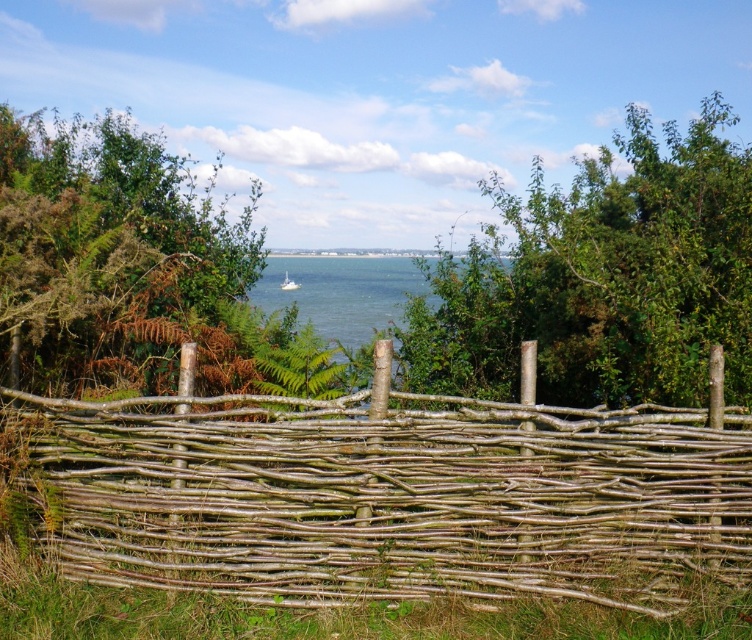
You are standing in front of the rustic wooden fence. There is a point marked at coordinates point [341,291]. What is located at this point?

The point [341,291] marks clear blue water at center.

You are a painter wanting to capture the scene. You notice the green leafy bush at upper left and the clear blue water at center. Which object should you focus on if you want to depict the larger element in your painting?

The green leafy bush at upper left is larger than the clear blue water at center, so you should focus on the green leafy bush at upper left to depict the larger element in your painting.

Based on the photo, you are standing in front of the rustic wooden fence. You see the clear blue water at center and the white plastic boat at center. Which object is closer to you?

The clear blue water at center is closer to the viewer than the white plastic boat at center.